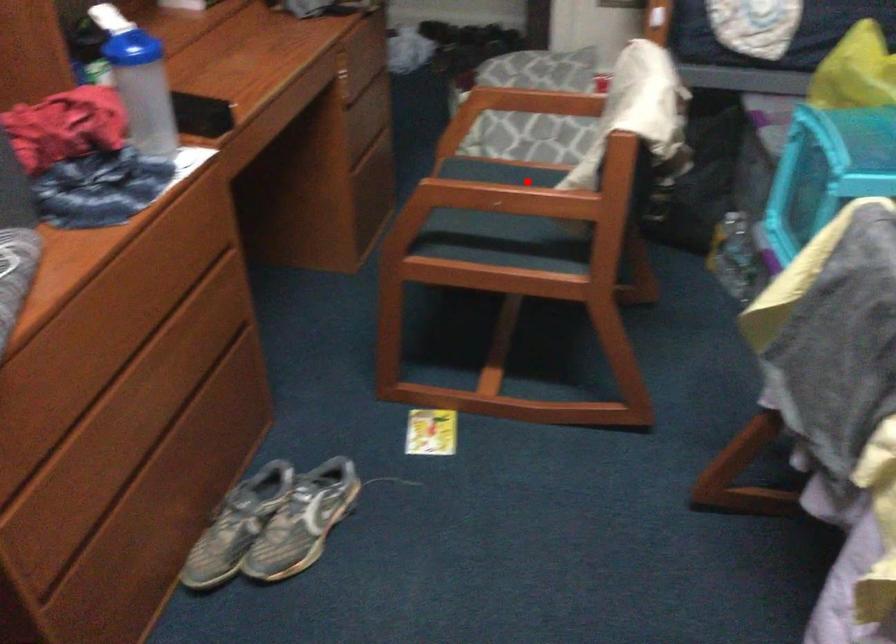
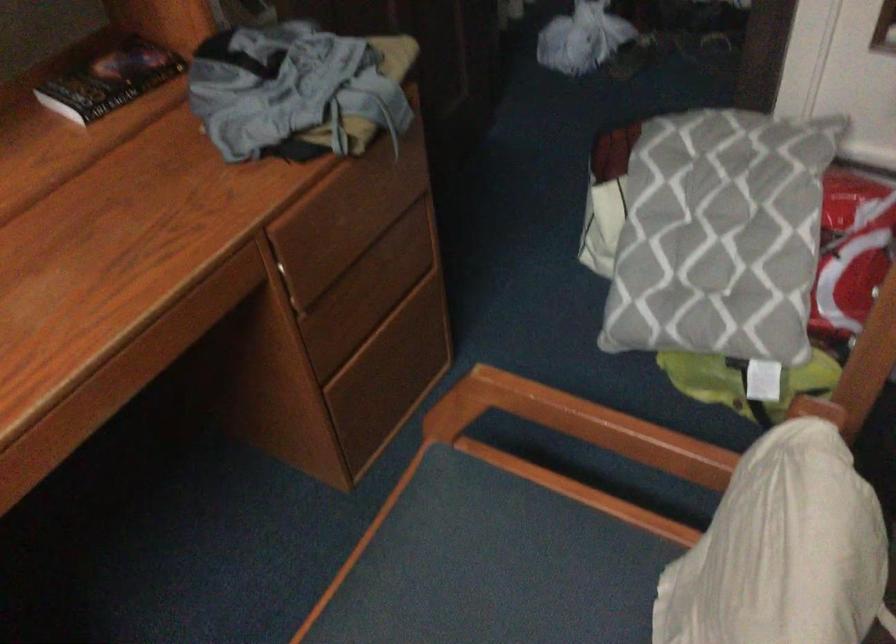
Where in the second image is the point corresponding to the highlighted location from the first image?

(549, 580)